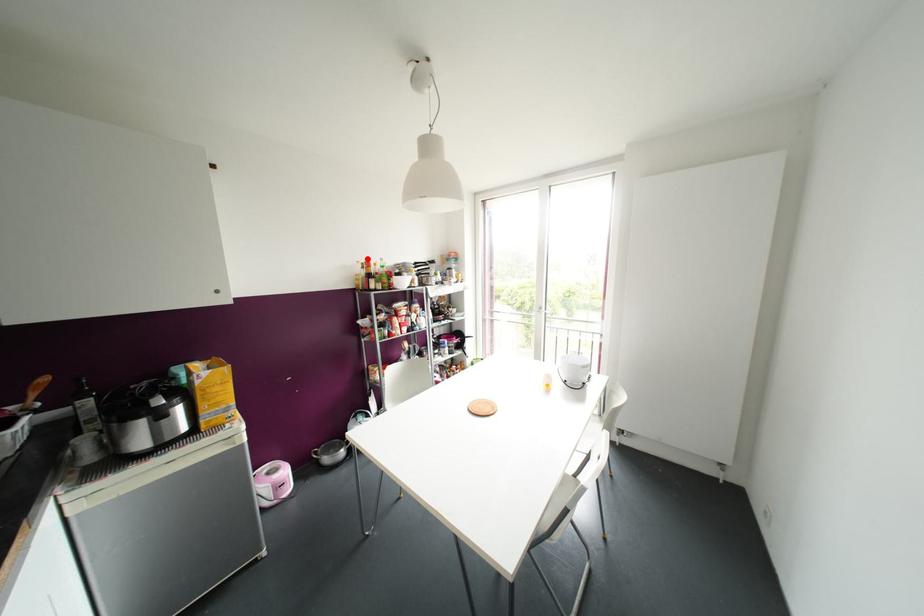
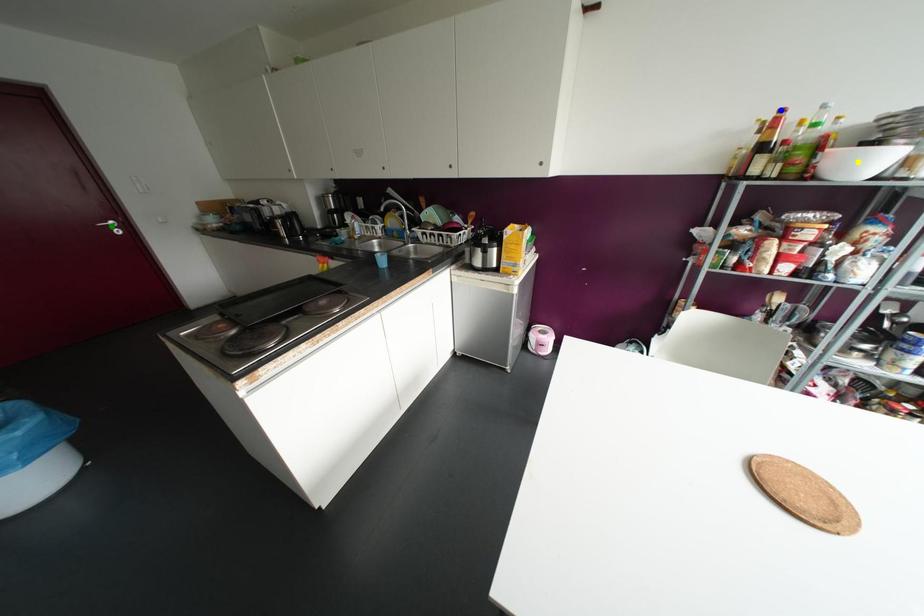
Question: I am providing you with two images of the same scene from different viewpoints. A red point is marked on the first image. You are given multiple points on the second image. In image 2, which mark is for the same physical point as the one in image 1?

Choices:
 (A) yellow point
 (B) green point
 (C) blue point

Answer: (C)